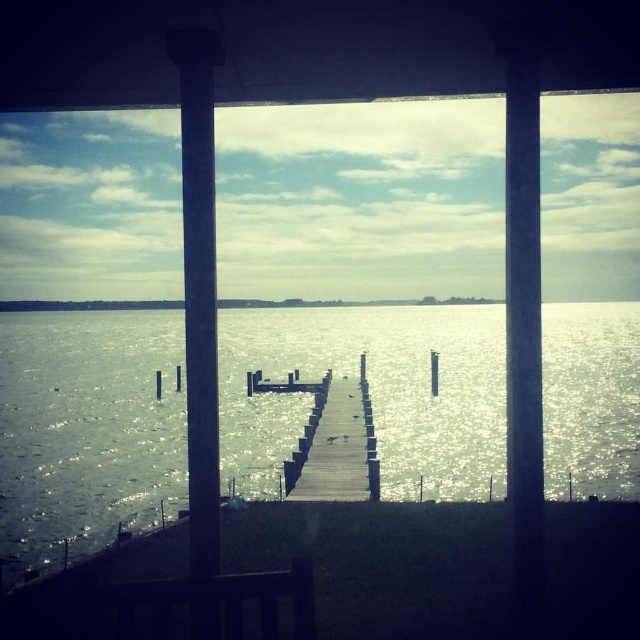
Question: Which point is closer to the camera?

Choices:
 (A) wooden dock at center
 (B) smooth concrete pillar at center
 (C) glistening silver water at center

Answer: (B)

Question: Does glistening silver water at center have a larger size compared to wooden dock at center?

Choices:
 (A) yes
 (B) no

Answer: (A)

Question: In this image, where is smooth concrete pillar at center located relative to wooden dock at center?

Choices:
 (A) left
 (B) right

Answer: (A)

Question: Is glistening silver water at center to the left of smooth concrete pillar at center from the viewer's perspective?

Choices:
 (A) yes
 (B) no

Answer: (B)

Question: Estimate the real-world distances between objects in this image. Which object is closer to the smooth concrete pillar at center?

Choices:
 (A) glistening silver water at center
 (B) wooden dock at center

Answer: (B)

Question: Which object is closer to the camera taking this photo?

Choices:
 (A) glistening silver water at center
 (B) wooden dock at center
 (C) smooth concrete pillar at center

Answer: (C)